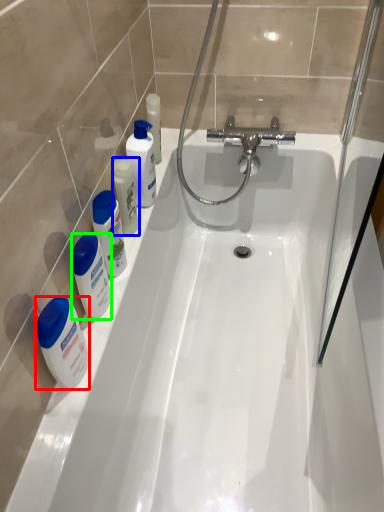
Question: Estimate the real-world distances between objects in this image. Which object is farther from mouthwash (highlighted by a red box), mouthwash (highlighted by a blue box) or cleaning product (highlighted by a green box)?

Choices:
 (A) mouthwash
 (B) cleaning product

Answer: (A)